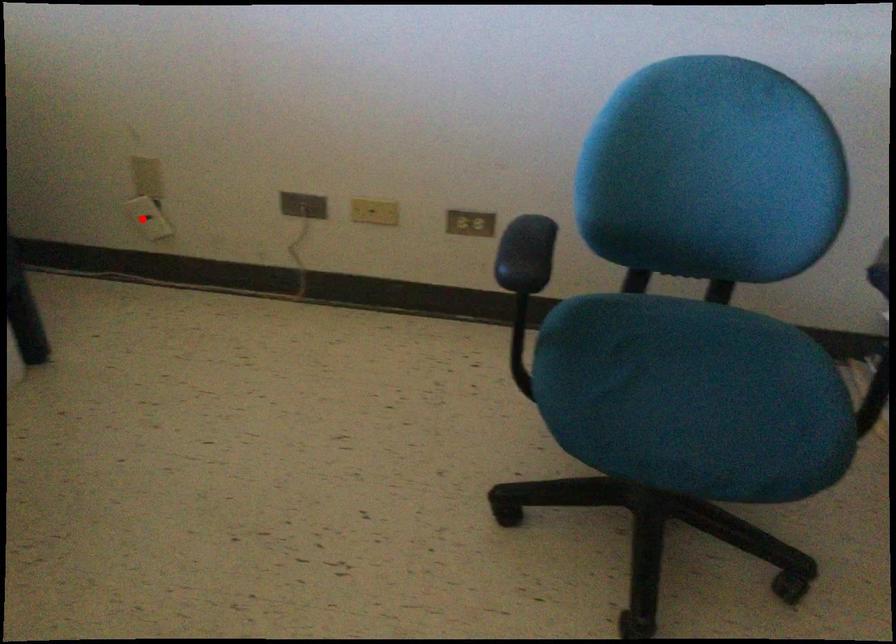
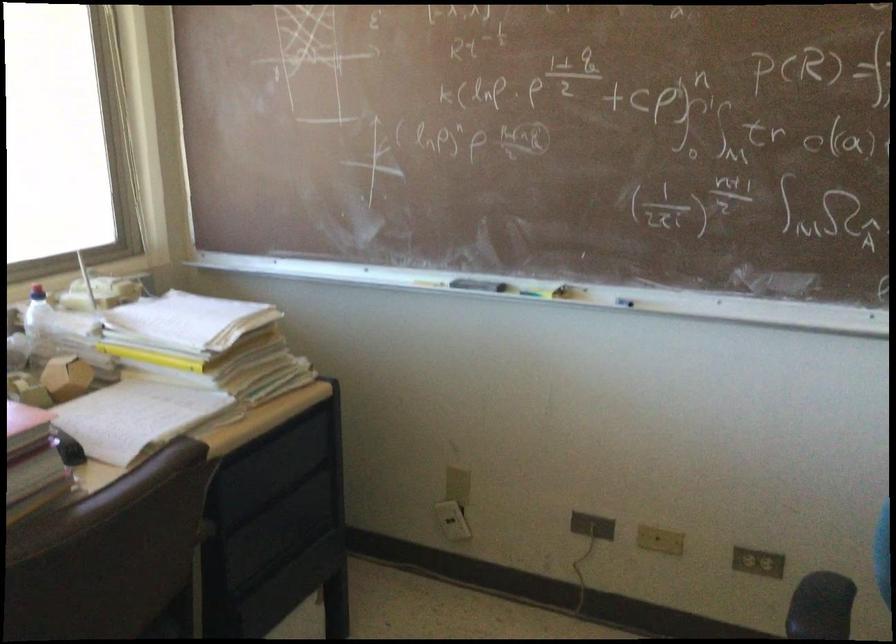
Question: I am providing you with two images of the same scene from different viewpoints. Given a red point in image1, look at the same physical point in image2. Is it:

Choices:
 (A) Closer to the viewpoint
 (B) Farther from the viewpoint

Answer: (B)